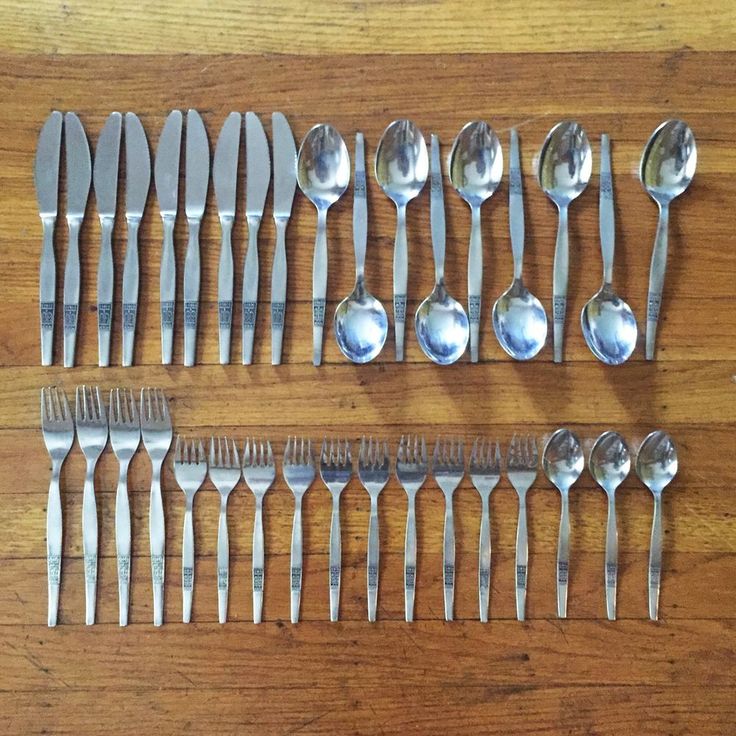
You are a GUI agent. You are given a task and a screenshot of the screen. Output one action in this format:
    pyautogui.click(x=<x>, y=<y>)
    Task: Click on the knives
    The width and height of the screenshot is (736, 736).
    Given the screenshot: What is the action you would take?
    pyautogui.click(x=43, y=163), pyautogui.click(x=79, y=163), pyautogui.click(x=110, y=163), pyautogui.click(x=141, y=166), pyautogui.click(x=169, y=169), pyautogui.click(x=207, y=171), pyautogui.click(x=219, y=174), pyautogui.click(x=258, y=176), pyautogui.click(x=279, y=177)